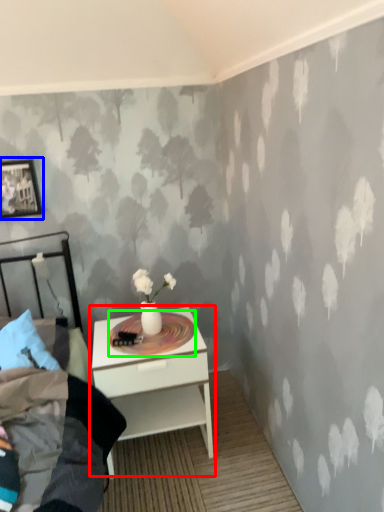
Question: Which object is the closest to the nightstand (highlighted by a red box)? Choose among these: picture frame (highlighted by a blue box) or round table (highlighted by a green box).

Choices:
 (A) picture frame
 (B) round table

Answer: (B)